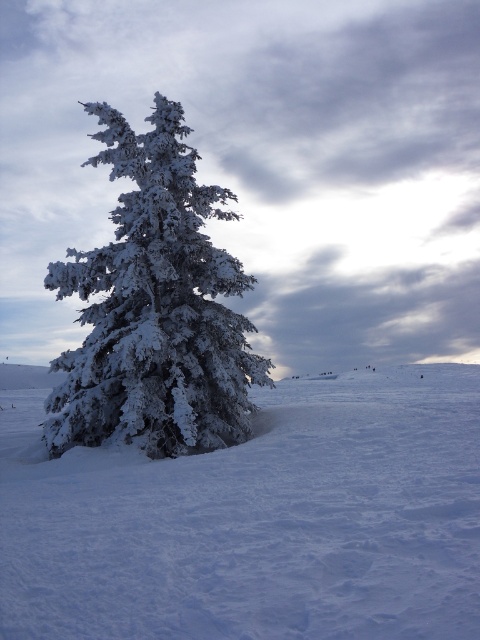
You are standing at the base of the snow covered tree in the image. You see a point marked at coordinates (256, 520). What is located at that point?

The point at coordinates (256, 520) corresponds to white fluffy snow at center.

You are an observer standing in the winter landscape. You notice the white fluffy snow at center and the white frosty tree at center. Which object is taller?

The white fluffy snow at center is much taller than the white frosty tree at center.